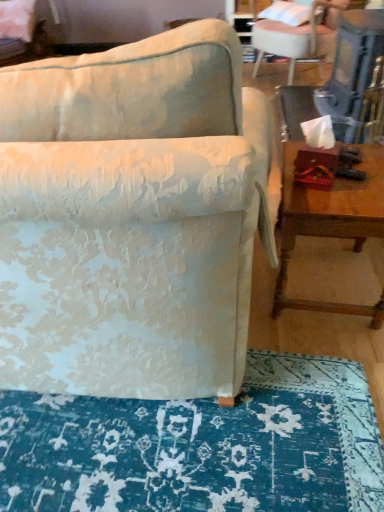
Question: Is textured fabric chair at center, the 1th chair in the left-to-right sequence, thinner than blue textured rug at lower center?

Choices:
 (A) no
 (B) yes

Answer: (A)

Question: Is textured fabric chair at center, which ranks as the 2th chair in right-to-left order, further to camera compared to blue textured rug at lower center?

Choices:
 (A) no
 (B) yes

Answer: (A)

Question: Is textured fabric chair at center, arranged as the 1th chair when ordered from the bottom, at the left side of blue textured rug at lower center?

Choices:
 (A) no
 (B) yes

Answer: (B)

Question: Is textured fabric chair at center, the 2th chair in the top-to-bottom sequence, outside of blue textured rug at lower center?

Choices:
 (A) no
 (B) yes

Answer: (B)

Question: From the image's perspective, would you say textured fabric chair at center, which is the second chair from back to front, is positioned over blue textured rug at lower center?

Choices:
 (A) yes
 (B) no

Answer: (A)

Question: Is textured fabric chair at center, arranged as the 1th chair when ordered from the bottom, facing away from blue textured rug at lower center?

Choices:
 (A) yes
 (B) no

Answer: (B)

Question: From a real-world perspective, is wooden table at right positioned under textured fabric chair at center, which ranks as the 2th chair in right-to-left order, based on gravity?

Choices:
 (A) yes
 (B) no

Answer: (A)

Question: Does wooden table at right have a smaller size compared to textured fabric chair at center, which is the second chair from back to front?

Choices:
 (A) yes
 (B) no

Answer: (A)

Question: Considering the relative positions of wooden table at right and textured fabric chair at center, the 2th chair in the top-to-bottom sequence, in the image provided, is wooden table at right to the right of textured fabric chair at center, the 2th chair in the top-to-bottom sequence, from the viewer's perspective?

Choices:
 (A) no
 (B) yes

Answer: (B)

Question: Considering the relative positions of wooden table at right and textured fabric chair at center, arranged as the 1th chair when ordered from the bottom, in the image provided, is wooden table at right behind textured fabric chair at center, arranged as the 1th chair when ordered from the bottom,?

Choices:
 (A) no
 (B) yes

Answer: (B)

Question: From a real-world perspective, is wooden table at right physically above textured fabric chair at center, which ranks as the 2th chair in right-to-left order?

Choices:
 (A) no
 (B) yes

Answer: (A)

Question: Can textured fabric chair at center, the 2th chair in the top-to-bottom sequence, be found inside wooden table at right?

Choices:
 (A) yes
 (B) no

Answer: (B)

Question: Can you confirm if blue textured rug at lower center is taller than white fabric chair at upper right, arranged as the second chair when viewed from the left?

Choices:
 (A) no
 (B) yes

Answer: (A)